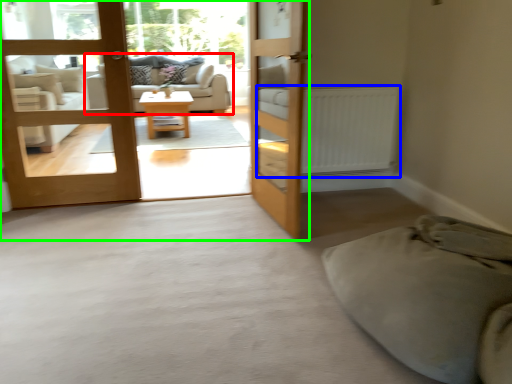
Question: Based on their relative distances, which object is farther from studio couch (highlighted by a red box)? Choose from radiator (highlighted by a blue box) and bunk bed (highlighted by a green box).

Choices:
 (A) radiator
 (B) bunk bed

Answer: (A)